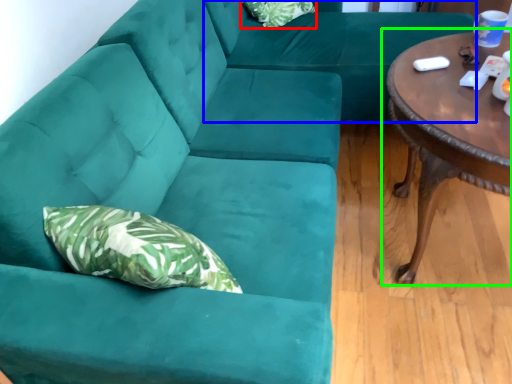
Question: Which object is the closest to the pillow (highlighted by a red box)? Choose among these: couch (highlighted by a blue box) or coffee table (highlighted by a green box).

Choices:
 (A) couch
 (B) coffee table

Answer: (A)